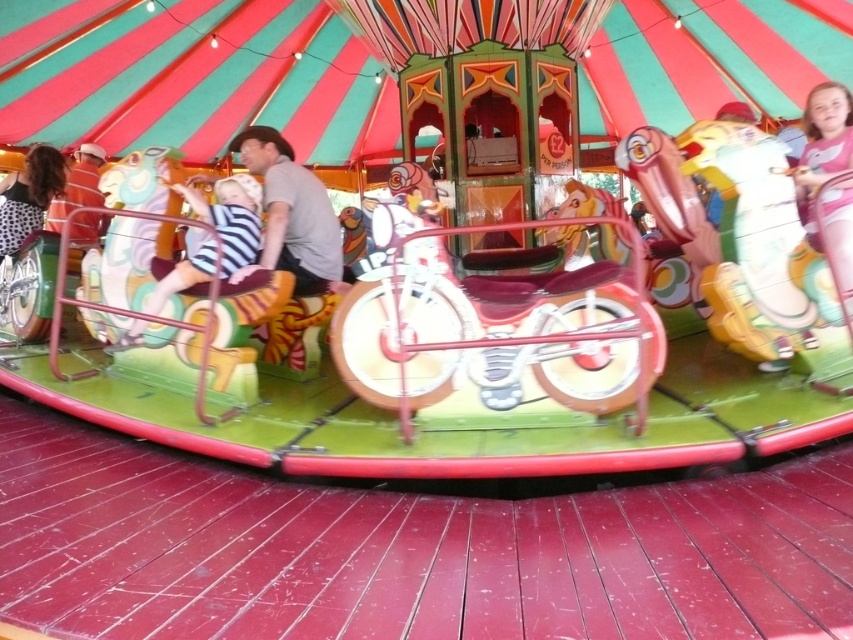
You are a photographer at the fairground trying to capture a photo of the carousel. You notice two people in the foreground wearing a matte gray shirt at center and a pink fabric dress at upper right. Which clothing item is positioned higher in the frame?

The matte gray shirt at center is located above the pink fabric dress at upper right, so it is positioned higher in the frame.

You are standing at the center of the carousel and looking towards the upper right corner of the tent. Which object is located at the point marked by coordinates (824, 136)?

The point marked by coordinates (824, 136) is where the pink fabric dress at upper right is located.